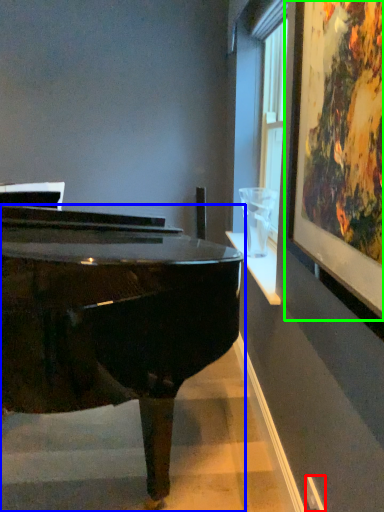
Question: Estimate the real-world distances between objects in this image. Which object is closer to power outlet (highlighted by a red box), piano (highlighted by a blue box) or picture frame (highlighted by a green box)?

Choices:
 (A) piano
 (B) picture frame

Answer: (A)